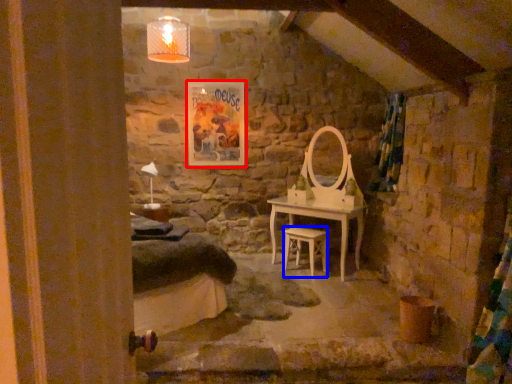
Question: Among these objects, which one is nearest to the camera, picture frame (highlighted by a red box) or stool (highlighted by a blue box)?

Choices:
 (A) picture frame
 (B) stool

Answer: (B)